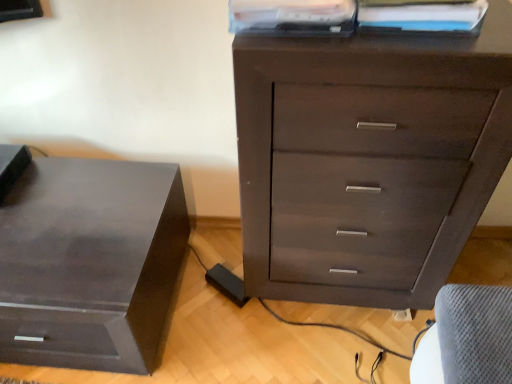
Question: Looking at the image, does dark wood chest of drawers at center seem bigger or smaller compared to white paper at upper center, positioned as the first book in right-to-left order?

Choices:
 (A) big
 (B) small

Answer: (A)

Question: Considering the positions of dark wood chest of drawers at center and white paper at upper center, positioned as the first book in right-to-left order, in the image, is dark wood chest of drawers at center wider or thinner than white paper at upper center, positioned as the first book in right-to-left order,?

Choices:
 (A) thin
 (B) wide

Answer: (B)

Question: Considering the real-world distances, which object is farthest from the dark wood chest of drawers at center?

Choices:
 (A) white paper at upper center, positioned as the first book in right-to-left order
 (B) matte plastic book at upper center, which is the first book in left-to-right order
 (C) matte black nightstand at left

Answer: (C)

Question: Considering the real-world distances, which object is farthest from the matte plastic book at upper center, the 2th book in the right-to-left sequence?

Choices:
 (A) white paper at upper center, the second book viewed from the left
 (B) matte black nightstand at left
 (C) dark wood chest of drawers at center

Answer: (B)